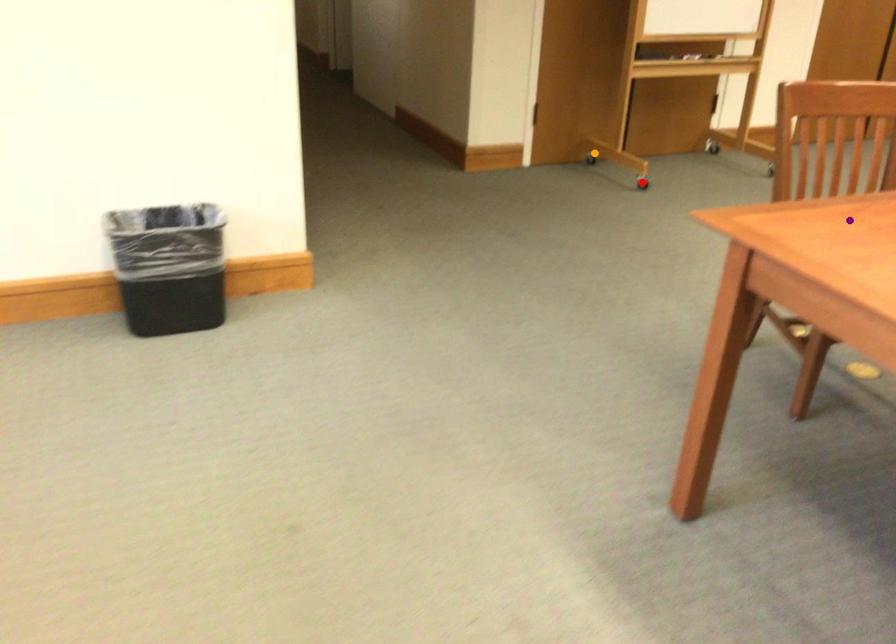
Order these from nearest to farthest:
- red point
- purple point
- orange point

orange point < red point < purple point